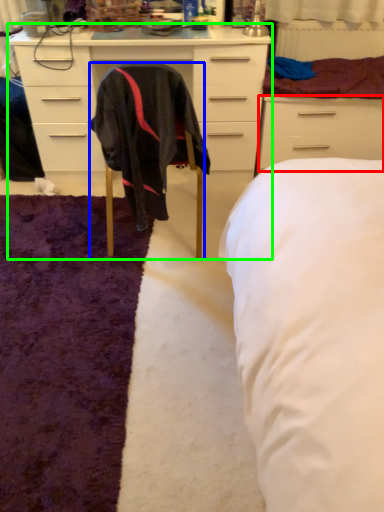
Question: Which object is the farthest from drawer (highlighted by a red box)? Choose among these: chair (highlighted by a blue box) or cabinetry (highlighted by a green box).

Choices:
 (A) chair
 (B) cabinetry

Answer: (A)